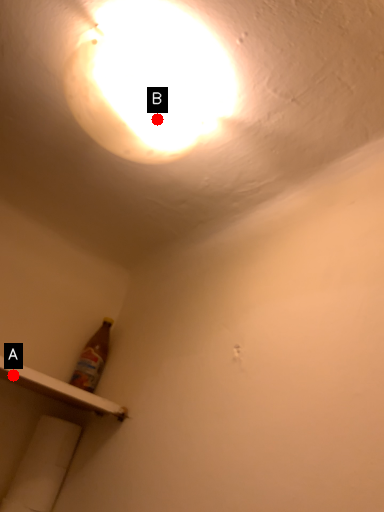
Question: Two points are circled on the image, labeled by A and B beside each circle. Which point appears closest to the camera in this image?

Choices:
 (A) A is closer
 (B) B is closer

Answer: (B)